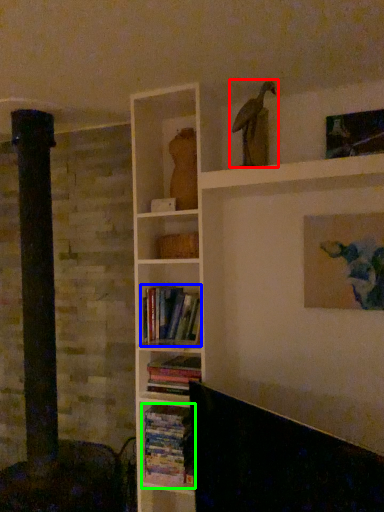
Question: Estimate the real-world distances between objects in this image. Which object is closer to bird (highlighted by a red box), book (highlighted by a blue box) or book (highlighted by a green box)?

Choices:
 (A) book
 (B) book

Answer: (A)